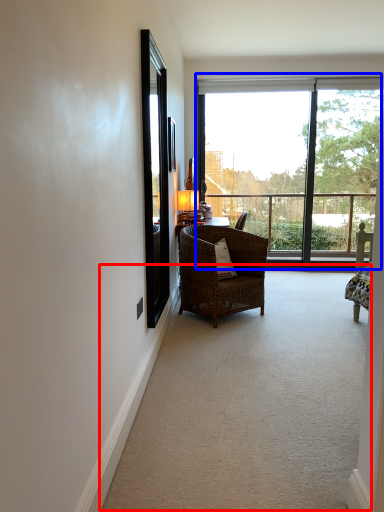
Question: Which object appears farthest to the camera in this image, corridor (highlighted by a red box) or window (highlighted by a blue box)?

Choices:
 (A) corridor
 (B) window

Answer: (B)